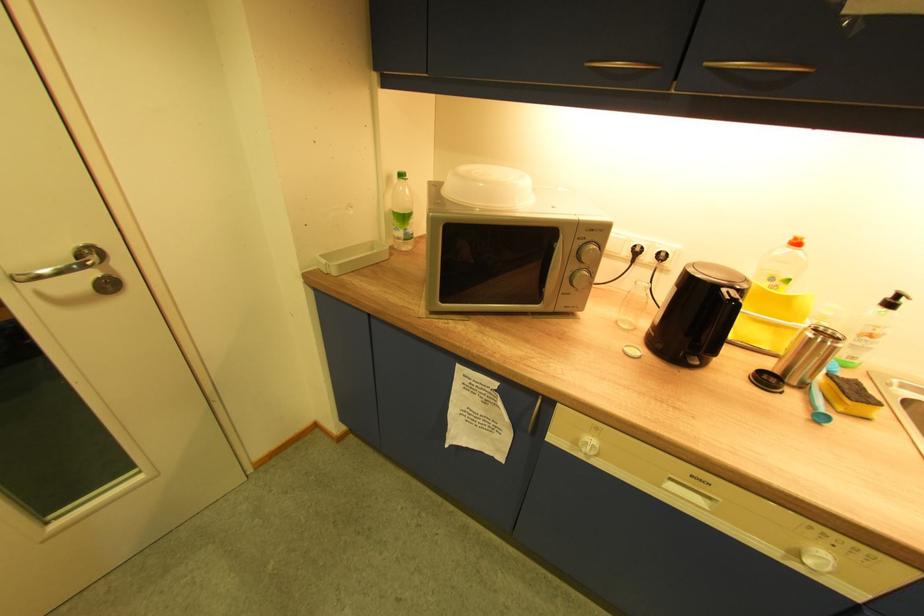
Where would you lift the clear plastic bottle? Please return your answer as a coordinate pair (x, y).

(402, 213)